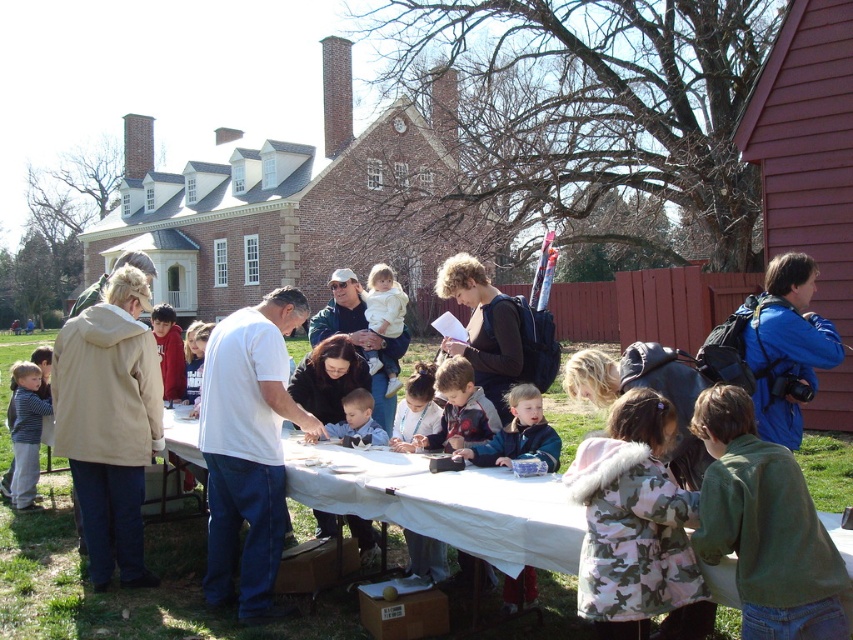
Question: Which of the following is the farthest from the observer?

Choices:
 (A) beige fleece jacket at left
 (B) white matte shirt at center
 (C) white cloth table at center

Answer: (A)

Question: Which of the following is the closest to the observer?

Choices:
 (A) white matte shirt at center
 (B) light blue fleece jacket at center

Answer: (B)

Question: Can you confirm if beige fleece jacket at left is positioned to the right of striped shirt at lower left?

Choices:
 (A) yes
 (B) no

Answer: (A)

Question: Which object is closer to the camera taking this photo?

Choices:
 (A) camo coat at lower right
 (B) striped shirt at lower left

Answer: (A)

Question: Is dark brown leather jacket at center closer to camera compared to white cotton shirt at center?

Choices:
 (A) no
 (B) yes

Answer: (B)

Question: Does beige fleece jacket at left have a larger size compared to white cotton shirt at center?

Choices:
 (A) no
 (B) yes

Answer: (A)